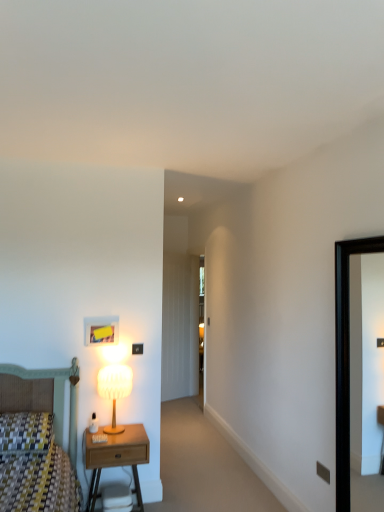
Question: Should I look upward or downward to see transparent glass door at center?

Choices:
 (A) down
 (B) up

Answer: (A)

Question: Is black glossy picture frame at right to the left of wooden nightstand at lower left from the viewer's perspective?

Choices:
 (A) yes
 (B) no

Answer: (B)

Question: Does black glossy picture frame at right touch wooden nightstand at lower left?

Choices:
 (A) no
 (B) yes

Answer: (A)

Question: From a real-world perspective, is black glossy picture frame at right positioned over wooden nightstand at lower left based on gravity?

Choices:
 (A) no
 (B) yes

Answer: (B)

Question: Is black glossy picture frame at right bigger than wooden nightstand at lower left?

Choices:
 (A) no
 (B) yes

Answer: (A)

Question: Is wooden nightstand at lower left located within black glossy picture frame at right?

Choices:
 (A) no
 (B) yes

Answer: (A)

Question: From the image's perspective, is black glossy picture frame at right below wooden nightstand at lower left?

Choices:
 (A) yes
 (B) no

Answer: (B)

Question: Does matte white lamp at left have a lesser height compared to transparent glass door at center?

Choices:
 (A) yes
 (B) no

Answer: (A)

Question: Is there a large distance between matte white lamp at left and transparent glass door at center?

Choices:
 (A) yes
 (B) no

Answer: (A)

Question: Is matte white lamp at left outside of transparent glass door at center?

Choices:
 (A) yes
 (B) no

Answer: (A)

Question: From a real-world perspective, is matte white lamp at left located higher than transparent glass door at center?

Choices:
 (A) no
 (B) yes

Answer: (A)

Question: Does matte white lamp at left have a greater height compared to transparent glass door at center?

Choices:
 (A) yes
 (B) no

Answer: (B)

Question: Could you tell me if matte white lamp at left is facing transparent glass door at center?

Choices:
 (A) yes
 (B) no

Answer: (B)

Question: From a real-world perspective, is transparent glass door at center located beneath matte white lamp at left?

Choices:
 (A) yes
 (B) no

Answer: (B)